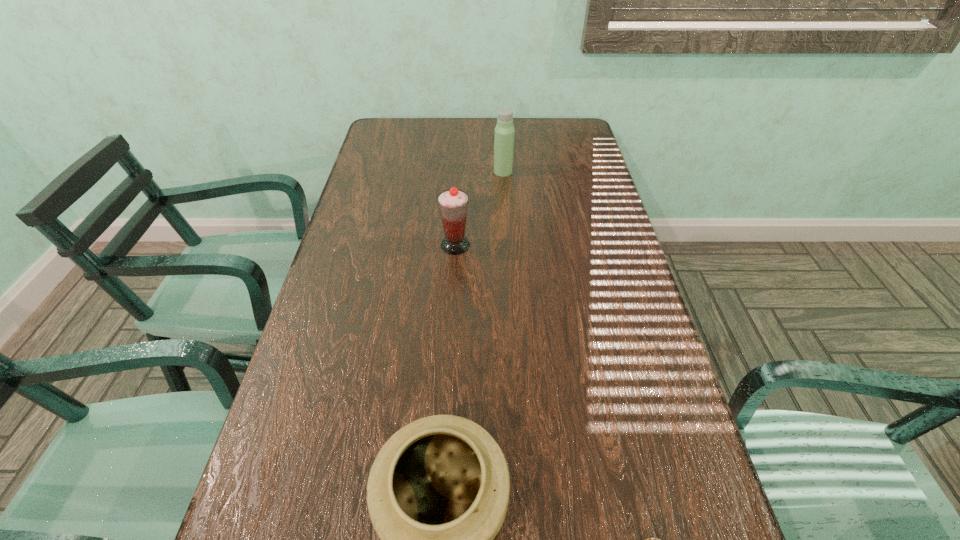
At what (x,y) coordinates should I click in order to perform the action: click on object that is the third nearest to the smoothie. Please return your answer as a coordinate pair (x, y). The width and height of the screenshot is (960, 540). Looking at the image, I should click on (650, 539).

The width and height of the screenshot is (960, 540). I want to click on the second closest object to the thermos bottle, so click(438, 491).